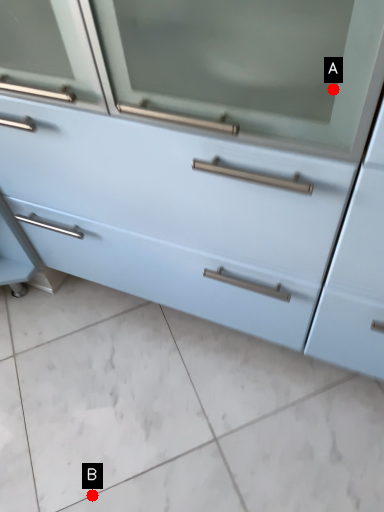
Question: Two points are circled on the image, labeled by A and B beside each circle. Which point appears closest to the camera in this image?

Choices:
 (A) A is closer
 (B) B is closer

Answer: (A)